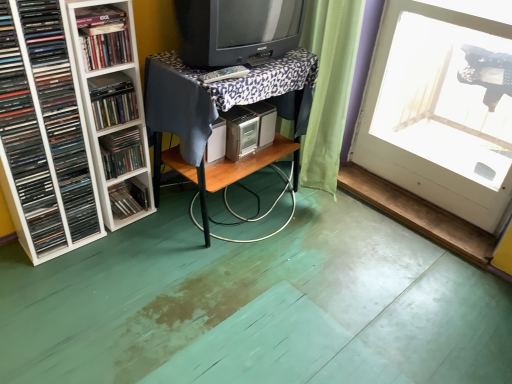
This screenshot has height=384, width=512. Identify the location of vacant area that lies to the right of white plastic shelf at left, which appears as the 3th book when viewed from the top. (118, 253).